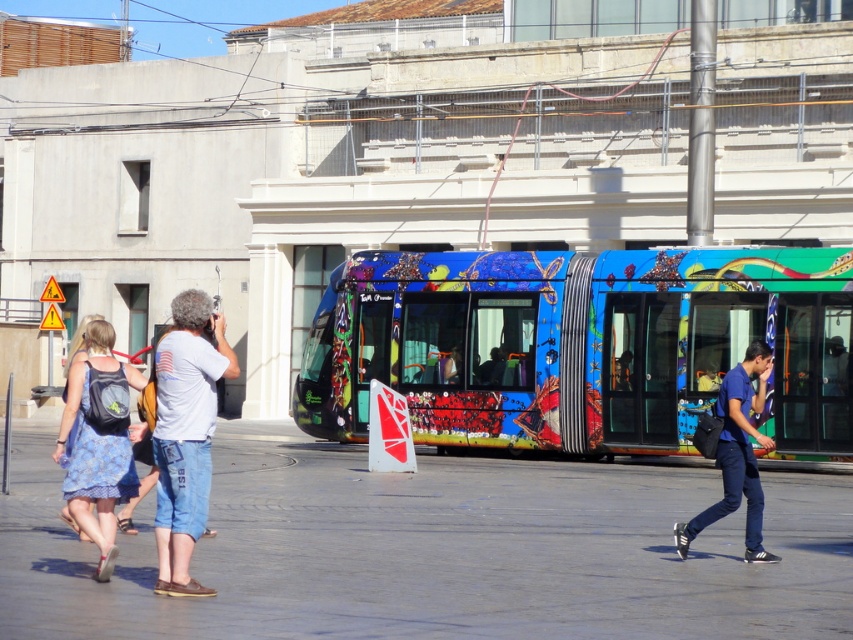
Which is below, smooth concrete pavement at center or blue floral dress at lower left?

smooth concrete pavement at center is below.

Is point (416, 508) behind point (68, 392)?

Yes, it is.

The width and height of the screenshot is (853, 640). I want to click on smooth concrete pavement at center, so click(x=433, y=550).

Which of these two, smooth concrete pavement at center or white cotton shirt at center, stands taller?

With more height is white cotton shirt at center.

Where is `smooth concrete pavement at center`? This screenshot has height=640, width=853. smooth concrete pavement at center is located at coordinates (433, 550).

Between white cotton shirt at center and blue floral dress at lower left, which one is positioned lower?

blue floral dress at lower left is below.

How distant is white cotton shirt at center from blue floral dress at lower left?

A distance of 3.93 feet exists between white cotton shirt at center and blue floral dress at lower left.

Which is behind, point (177, 349) or point (80, 433)?

Point (80, 433)

Identify the location of white cotton shirt at center. The height and width of the screenshot is (640, 853). (184, 433).